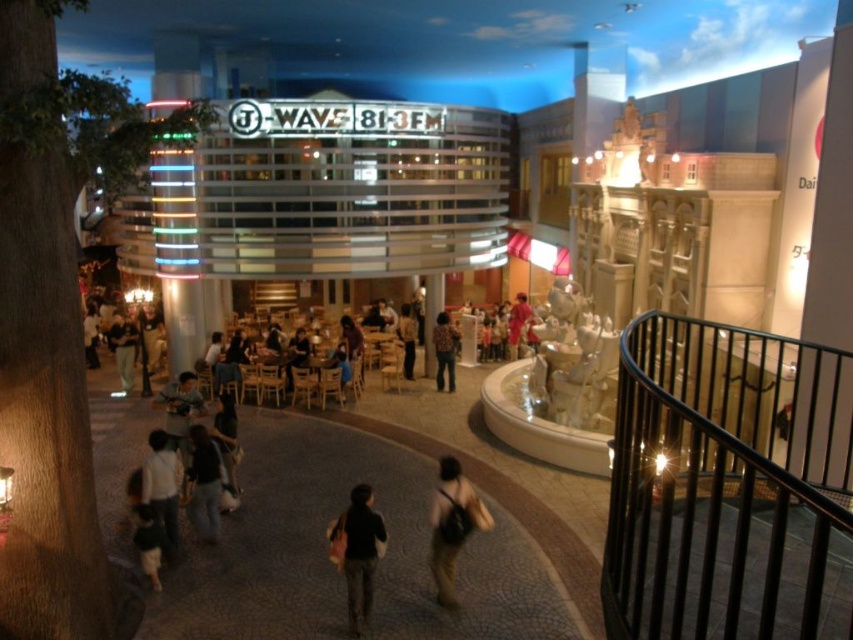
Question: Which object appears closest to the camera in this image?

Choices:
 (A) white cotton shirt at lower left
 (B) light brown leather backpack at center
 (C) dark brown leather jacket at center

Answer: (B)

Question: From the image, what is the correct spatial relationship of dark fabric jacket at center in relation to dark gray backpack at center?

Choices:
 (A) left
 (B) right

Answer: (B)

Question: Is dark gray backpack at center to the right of floral-patterned shirt at center from the viewer's perspective?

Choices:
 (A) yes
 (B) no

Answer: (B)

Question: Which of the following is the closest to the observer?

Choices:
 (A) dark gray backpack at center
 (B) light brown leather backpack at center
 (C) dark fabric jacket at center

Answer: (C)

Question: Does dark fabric jacket at center appear over white cotton shirt at lower left?

Choices:
 (A) no
 (B) yes

Answer: (A)

Question: Considering the real-world distances, which object is closest to the floral-patterned shirt at center?

Choices:
 (A) dark gray sweater at lower left
 (B) dark brown leather jacket at center
 (C) dark gray backpack at center

Answer: (B)